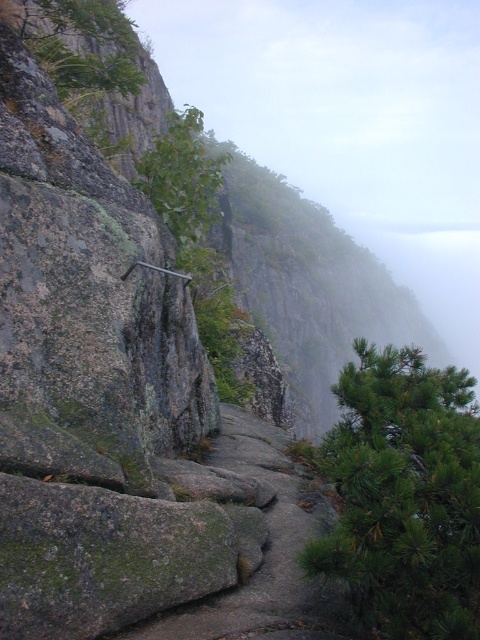
Does green needle-like tree at right have a smaller size compared to green mossy rock at center?

Incorrect, green needle-like tree at right is not smaller in size than green mossy rock at center.

Who is more distant from viewer, (407, 353) or (232, 417)?

The point (232, 417) is more distant.

Is point (477, 544) more distant than point (251, 467)?

No.

Find the location of a particular element. green needle-like tree at right is located at coordinates (405, 496).

Who is positioned more to the left, green needle-like tree at right or green leafy tree at upper left?

From the viewer's perspective, green leafy tree at upper left appears more on the left side.

Which is below, green needle-like tree at right or green leafy tree at upper left?

green needle-like tree at right is below.

Identify the location of green needle-like tree at right. The image size is (480, 640). (405, 496).

Where is `green mossy rock at center`? Image resolution: width=480 pixels, height=640 pixels. green mossy rock at center is located at coordinates (264, 550).

Is green mossy rock at center positioned before green leafy tree at upper left?

Yes, green mossy rock at center is in front of green leafy tree at upper left.

Locate an element on the screen. Image resolution: width=480 pixels, height=640 pixels. green mossy rock at center is located at coordinates (264, 550).

The image size is (480, 640). Find the location of `green mossy rock at center`. green mossy rock at center is located at coordinates (264, 550).